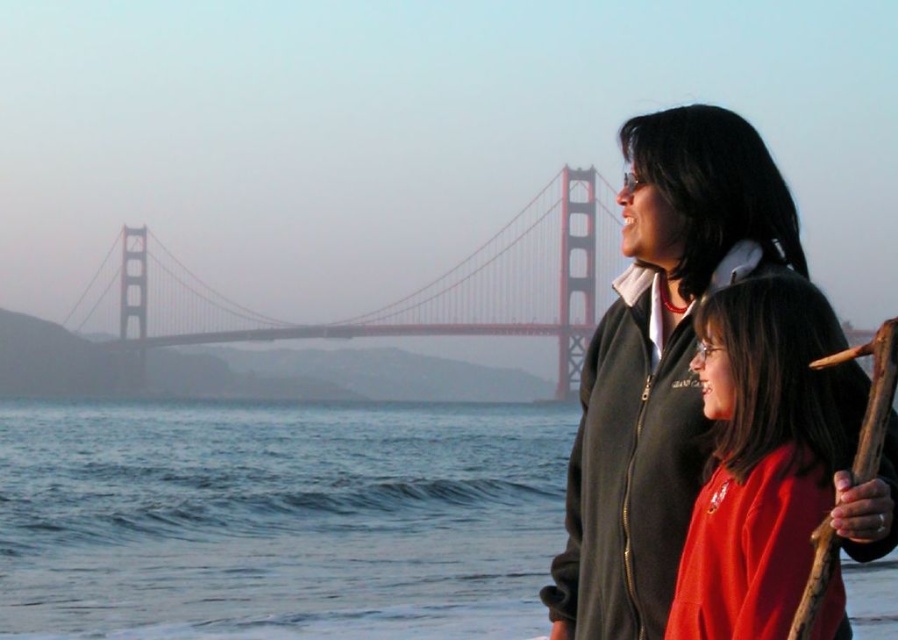
Is blue water at lower left taller than red painted steel bridge at center?

No, blue water at lower left is not taller than red painted steel bridge at center.

Locate an element on the screen. The height and width of the screenshot is (640, 898). blue water at lower left is located at coordinates (277, 520).

Is point (859, 636) less distant than point (536, 262)?

That is True.

This screenshot has height=640, width=898. What are the coordinates of `blue water at lower left` in the screenshot? It's located at (277, 520).

Is point (241, 440) closer to viewer compared to point (736, 637)?

That is False.

In the scene shown: Which is below, blue water at lower left or matte red sweater at center?

blue water at lower left

Find the location of a particular element. The width and height of the screenshot is (898, 640). blue water at lower left is located at coordinates (277, 520).

Measure the distance between matte red sweater at center and red painted steel bridge at center.

matte red sweater at center and red painted steel bridge at center are 495.79 meters apart.

Is point (716, 476) positioned behind point (517, 282)?

That is False.

Between point (819, 388) and point (103, 298), which one is positioned in front?

Positioned in front is point (819, 388).

The width and height of the screenshot is (898, 640). Find the location of `matte red sweater at center`. matte red sweater at center is located at coordinates (763, 456).